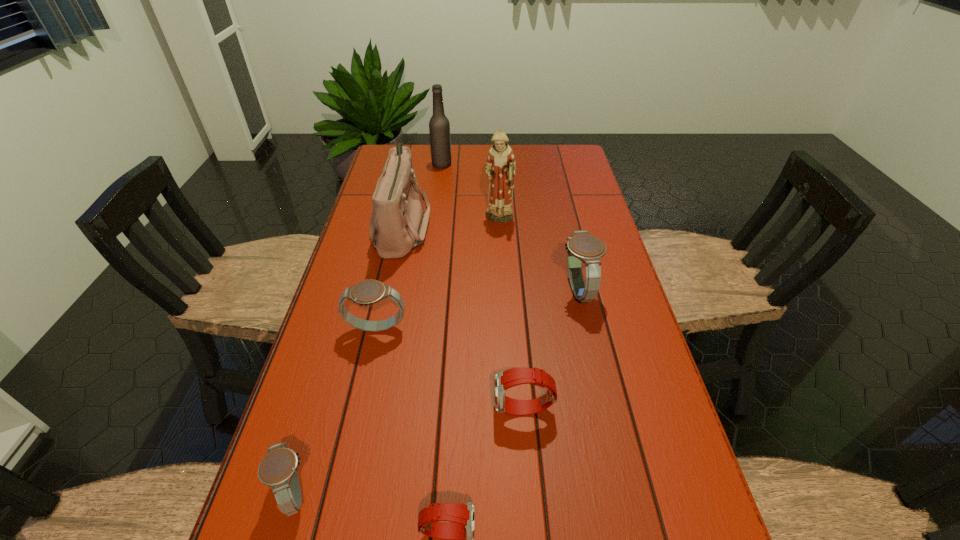
I want to click on blank space located on the front-facing side of the figurine, so click(504, 305).

This screenshot has width=960, height=540. I want to click on vacant space situated 0.380m on the front pocket of the sixth shortest object, so click(553, 227).

At what (x,y) coordinates should I click in order to perform the action: click on free space located 0.360m on the left of the biggest gray watch. Please return your answer as a coordinate pair (x, y). This screenshot has width=960, height=540. Looking at the image, I should click on (420, 292).

The height and width of the screenshot is (540, 960). I want to click on free space located on the back of the second biggest gray watch, so click(395, 248).

Locate an element on the screen. Image resolution: width=960 pixels, height=540 pixels. vacant space located 0.350m on the face of the farther red watch is located at coordinates (324, 410).

Image resolution: width=960 pixels, height=540 pixels. I want to click on vacant space situated on the face of the farther red watch, so click(x=308, y=410).

You are a GUI agent. You are given a task and a screenshot of the screen. Output one action in this format:
    pyautogui.click(x=<x>, y=<y>)
    Task: Click on the free region located 0.360m on the face of the farther red watch
    This screenshot has height=540, width=960.
    Given the screenshot: What is the action you would take?
    pyautogui.click(x=319, y=410)

Image resolution: width=960 pixels, height=540 pixels. In order to click on free region located 0.260m on the back of the smallest gray watch in this screenshot , I will do `click(337, 349)`.

What are the coordinates of `object at the far edge` in the screenshot? It's located at (439, 127).

At what (x,y) coordinates should I click in order to perform the action: click on shoulder bag that is at the left edge. Please return your answer as a coordinate pair (x, y). This screenshot has height=540, width=960. Looking at the image, I should click on (398, 223).